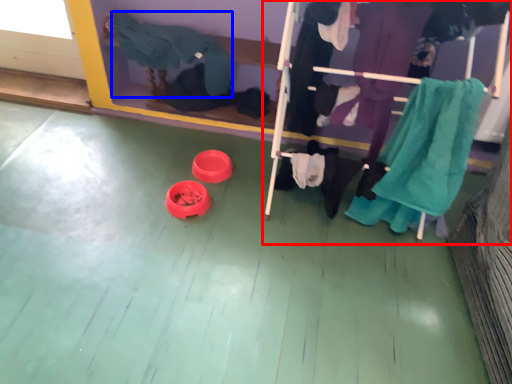
Question: Which of the following is the farthest to the observer, furniture (highlighted by a red box) or clothing (highlighted by a blue box)?

Choices:
 (A) furniture
 (B) clothing

Answer: (B)